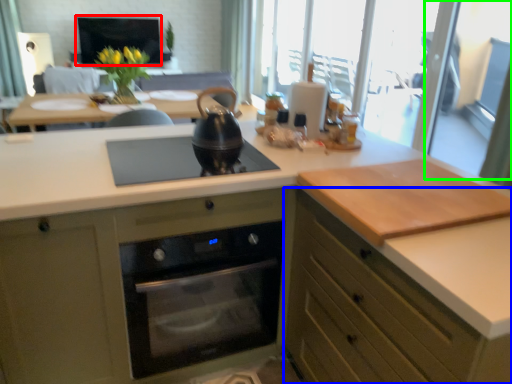
Question: Based on their relative distances, which object is farther from window screen (highlighted by a red box)? Choose from cabinetry (highlighted by a blue box) and screen door (highlighted by a green box).

Choices:
 (A) cabinetry
 (B) screen door

Answer: (A)